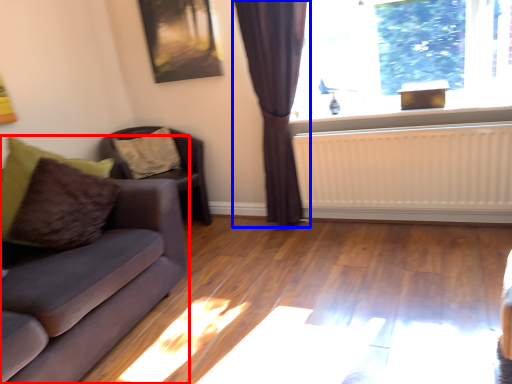
Question: Among these objects, which one is nearest to the camera, studio couch (highlighted by a red box) or curtain (highlighted by a blue box)?

Choices:
 (A) studio couch
 (B) curtain

Answer: (A)